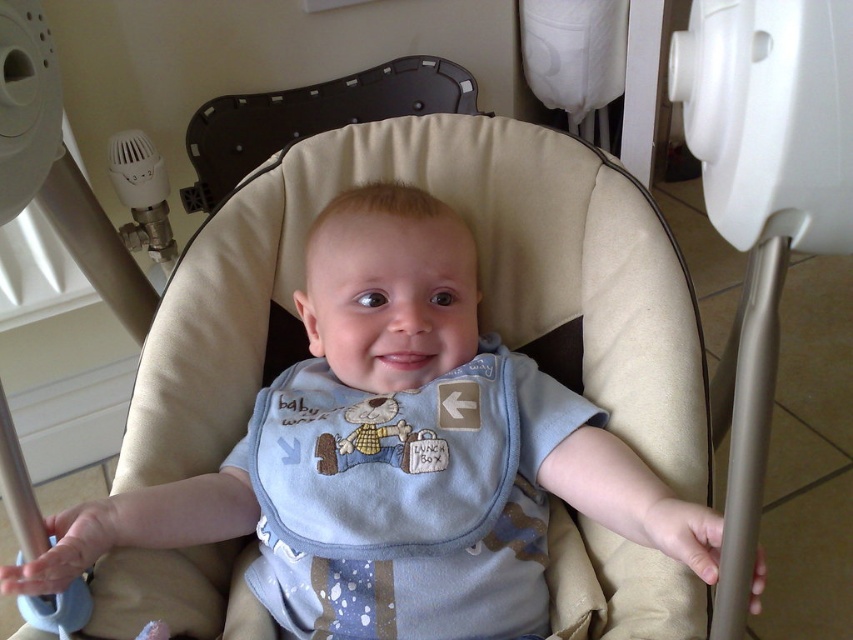
Question: Considering the relative positions of blue cotton bib at center and light blue fabric bib at center in the image provided, where is blue cotton bib at center located with respect to light blue fabric bib at center?

Choices:
 (A) below
 (B) above

Answer: (A)

Question: Is blue cotton bib at center positioned before black plastic feeding chair at upper center?

Choices:
 (A) yes
 (B) no

Answer: (A)

Question: Can you confirm if light blue fabric bib at center is thinner than black plastic feeding chair at upper center?

Choices:
 (A) yes
 (B) no

Answer: (B)

Question: Which point is farther to the camera?

Choices:
 (A) tap(577, 404)
 (B) tap(274, 497)

Answer: (A)

Question: Which object is positioned farthest from the light blue fabric bib at center?

Choices:
 (A) blue cotton bib at center
 (B) black plastic feeding chair at upper center

Answer: (B)

Question: Among these objects, which one is farthest from the camera?

Choices:
 (A) light blue fabric bib at center
 (B) blue cotton bib at center
 (C) black plastic feeding chair at upper center

Answer: (C)